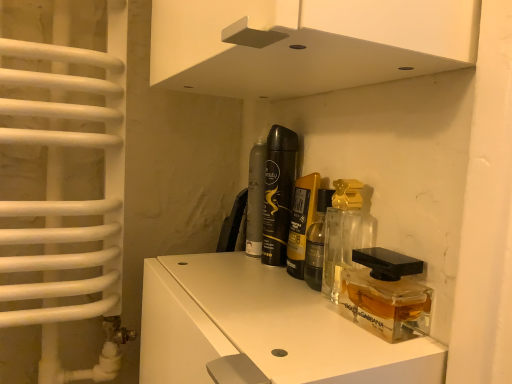
At what (x,y) coordinates should I click in order to perform the action: click on vacant space situated on the left part of clear glass perfume at center, the 4th perfume viewed from the back. Please return your answer as a coordinate pair (x, y). Image resolution: width=512 pixels, height=384 pixels. Looking at the image, I should click on (237, 288).